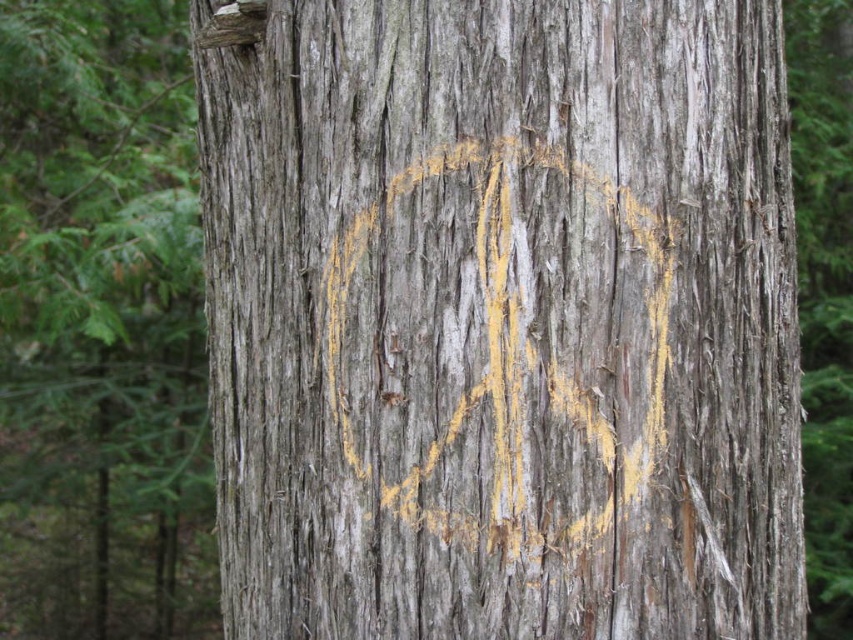
Which of these two, yellowish-brown wood at center or gray rough bark tree trunk at center, stands taller?

With more height is gray rough bark tree trunk at center.

Is yellowish-brown wood at center closer to camera compared to gray rough bark tree trunk at center?

Yes, yellowish-brown wood at center is closer to the viewer.

The width and height of the screenshot is (853, 640). What are the coordinates of `yellowish-brown wood at center` in the screenshot? It's located at (502, 320).